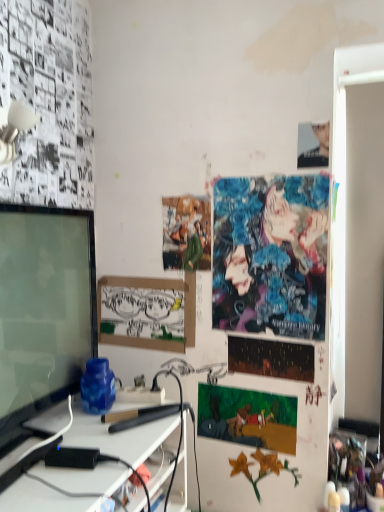
Question: Considering the positions of point (205, 245) and point (243, 340), is point (205, 245) closer or farther from the camera than point (243, 340)?

Choices:
 (A) farther
 (B) closer

Answer: (A)

Question: From the image's perspective, relative to dark matte poster at center, which is the 3th poster page in top-to-bottom order, is matte green fabric poster at center, acting as the fourth poster page starting from the bottom, above or below?

Choices:
 (A) above
 (B) below

Answer: (A)

Question: Which of these objects is positioned farthest from the dark matte poster at center, which is the 3th poster page in top-to-bottom order?

Choices:
 (A) matte green fabric poster at center, acting as the fourth poster page starting from the bottom
 (B) matte black monitor at left
 (C) white paper at center
 (D) smooth black shirt at upper right
 (E) cartoon paper at center, arranged as the 1th poster page when ordered from the bottom

Answer: (D)

Question: Based on their relative distances, which object is nearer to the vibrant digital art at upper right, the 2th poster page in the top-to-bottom sequence?

Choices:
 (A) dark matte poster at center, which is the 3th poster page in top-to-bottom order
 (B) matte green fabric poster at center, the 1th poster page viewed from the top
 (C) matte black monitor at left
 (D) cartoon paper at center, the 4th poster page when ordered from top to bottom
 (E) smooth black shirt at upper right

Answer: (B)